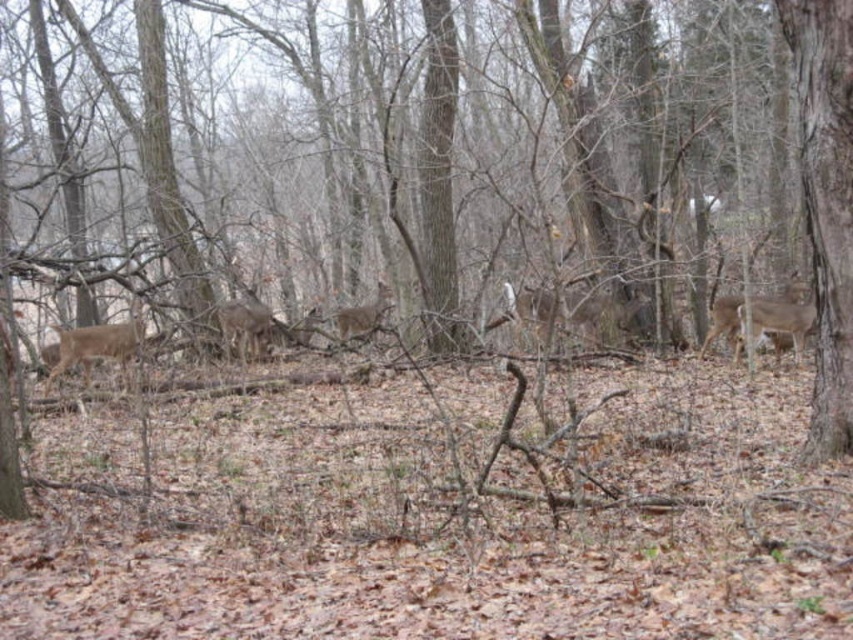
Question: Which object is closer to the camera taking this photo?

Choices:
 (A) brown matte/deer at center-right
 (B) brown fur deer at left

Answer: (B)

Question: Can you confirm if brown fur deer at left is smaller than brown matte/deer at center-right?

Choices:
 (A) yes
 (B) no

Answer: (B)

Question: Can you confirm if brown rough bark tree at right is thinner than brown matte deer at center?

Choices:
 (A) yes
 (B) no

Answer: (A)

Question: Which point appears closest to the camera in this image?

Choices:
 (A) (824, 29)
 (B) (341, 314)
 (C) (103, 346)

Answer: (A)

Question: Can you confirm if brown fur deer at left is positioned above brown matte deer at center?

Choices:
 (A) yes
 (B) no

Answer: (B)

Question: Among these points, which one is farthest from the camera?

Choices:
 (A) (699, 355)
 (B) (223, 332)
 (C) (833, 342)
 (D) (360, 323)

Answer: (D)